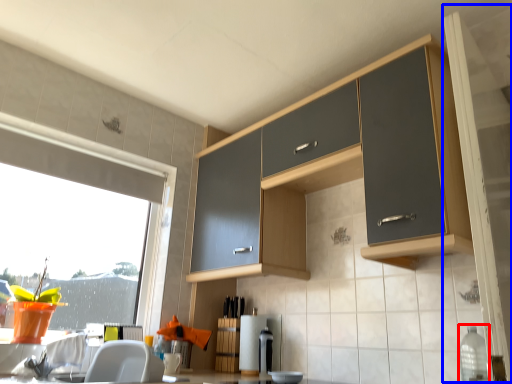
Question: Among these objects, which one is nearest to the camera, bottle (highlighted by a red box) or screen door (highlighted by a blue box)?

Choices:
 (A) bottle
 (B) screen door

Answer: (B)